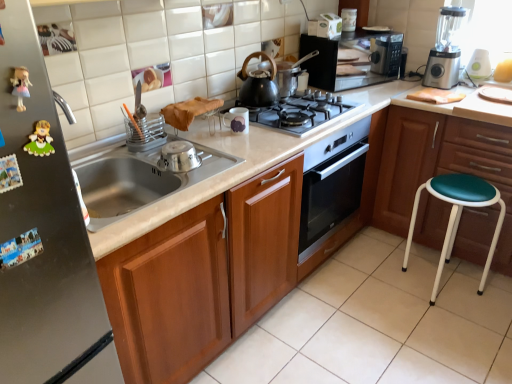
You are a GUI agent. You are given a task and a screenshot of the screen. Output one action in this format:
    pyautogui.click(x=<x>, y=<y>)
    Task: Click on the vacant point to the right of stainless steel bowl at sink, the 1th appliance positioned from the bottom
    The height and width of the screenshot is (384, 512).
    Given the screenshot: What is the action you would take?
    pyautogui.click(x=231, y=161)